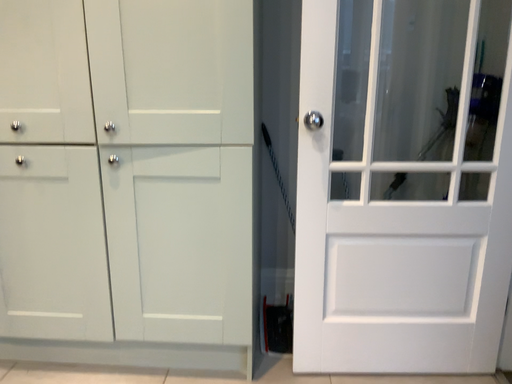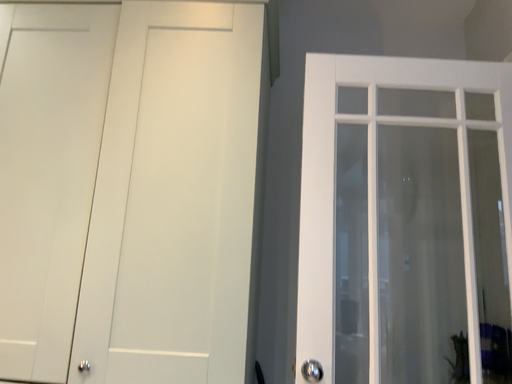
Question: How did the camera likely rotate when shooting the video?

Choices:
 (A) rotated downward
 (B) rotated upward

Answer: (B)